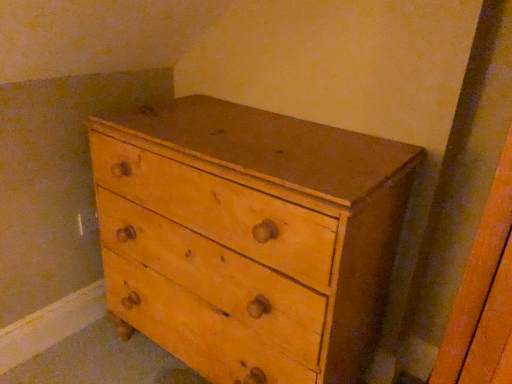
I want to click on free space above wooden chest of drawers at center (from a real-world perspective), so click(271, 129).